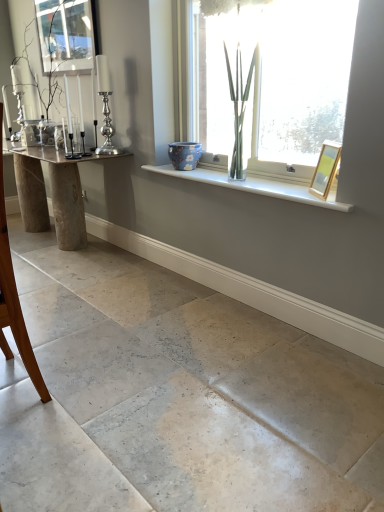
Question: From the image's perspective, relative to brown wooden chair at left, is white glossy window sill at upper center above or below?

Choices:
 (A) below
 (B) above

Answer: (B)

Question: From their relative heights in the image, would you say white glossy window sill at upper center is taller or shorter than brown wooden chair at left?

Choices:
 (A) short
 (B) tall

Answer: (A)

Question: Estimate the real-world distances between objects in this image. Which object is closer to the clear glass vase at left?

Choices:
 (A) wooden picture frame at upper right
 (B) blue glossy vase at center
 (C) brown wooden chair at left
 (D) clear glass window screen at upper left
 (E) white glossy window sill at upper center

Answer: (D)

Question: Estimate the real-world distances between objects in this image. Which object is closer to the transparent glass vase at upper center?

Choices:
 (A) blue glossy vase at center
 (B) clear glass vase at left
 (C) white glossy window sill at upper center
 (D) brown wooden chair at left
 (E) wooden picture frame at upper right

Answer: (C)